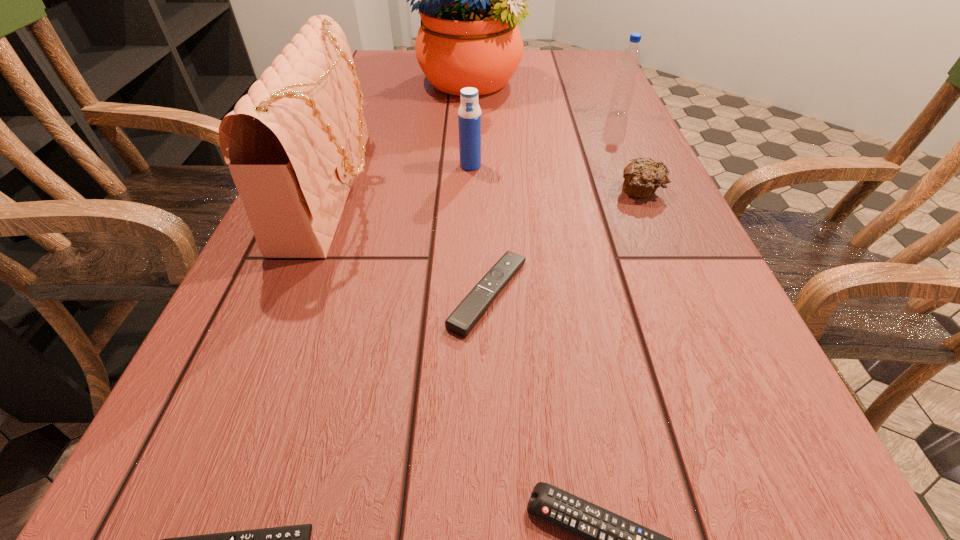
Locate an element on the screen. This screenshot has width=960, height=540. vacant space located on the front-facing side of the second tallest object is located at coordinates (496, 188).

Identify the location of vacant space positioned 0.330m on the left of the farther water bottle. The height and width of the screenshot is (540, 960). (477, 113).

I want to click on free space located on the right of the nearer water bottle, so coord(608,166).

I want to click on free location located 0.160m on the back of the fifth tallest object, so click(x=618, y=139).

Identify the location of vacant area located 0.270m on the back of the third shortest object. The width and height of the screenshot is (960, 540). (486, 168).

I want to click on object that is at the far edge, so click(470, 0).

I want to click on object situated at the left edge, so [293, 144].

You are a GUI agent. You are given a task and a screenshot of the screen. Output one action in this format:
    pyautogui.click(x=<x>, y=<y>)
    Task: Click on the water bottle that is at the right edge
    
    Given the screenshot: What is the action you would take?
    pyautogui.click(x=630, y=60)

The width and height of the screenshot is (960, 540). Find the location of `muffin that is positioned at the right edge`. muffin that is positioned at the right edge is located at coordinates (642, 177).

In order to click on vacant region at the far edge of the desktop in this screenshot , I will do `click(529, 63)`.